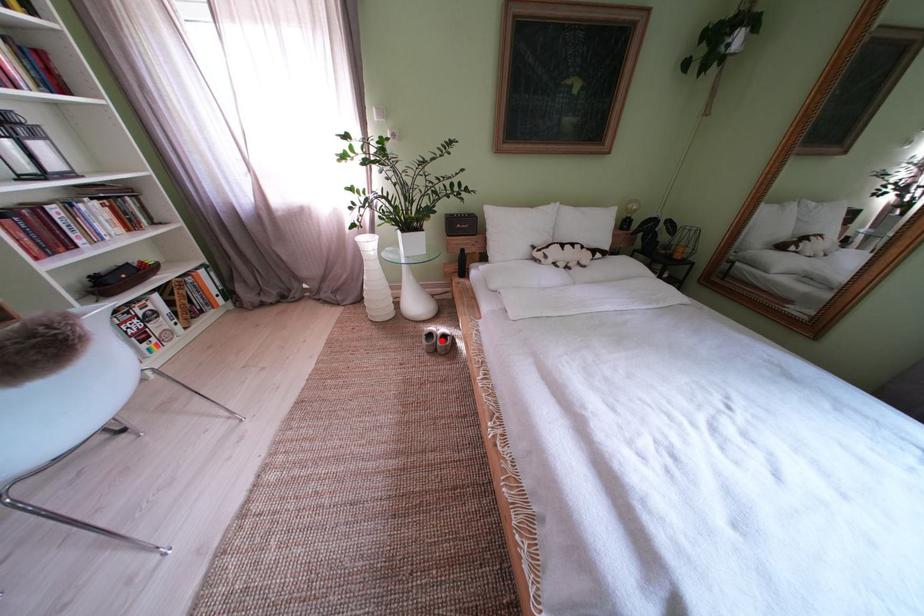
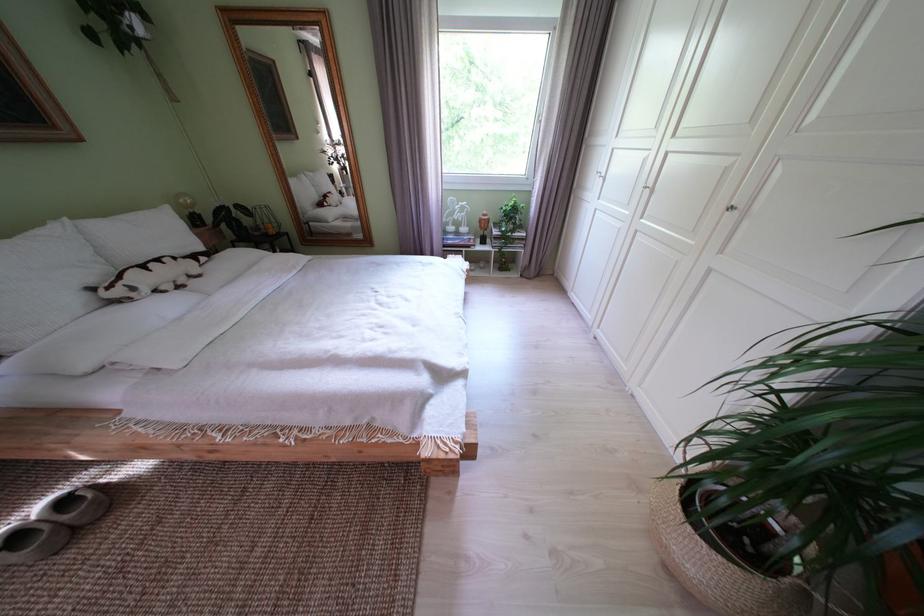
Question: I am providing you with two images of the same scene from different viewpoints. A red point is shown in image1. For the corresponding object point in image2, is it positioned nearer or farther from the camera?

Choices:
 (A) Nearer
 (B) Farther

Answer: (A)